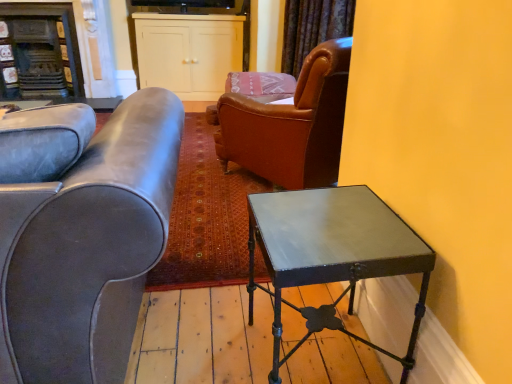
Question: From the image's perspective, is leather couch at left under velvet dark brown curtain at upper center?

Choices:
 (A) yes
 (B) no

Answer: (A)

Question: Is leather couch at left next to velvet dark brown curtain at upper center and touching it?

Choices:
 (A) yes
 (B) no

Answer: (B)

Question: Is leather couch at left at the right side of velvet dark brown curtain at upper center?

Choices:
 (A) yes
 (B) no

Answer: (B)

Question: Can you confirm if leather couch at left is wider than velvet dark brown curtain at upper center?

Choices:
 (A) no
 (B) yes

Answer: (B)

Question: Does leather couch at left have a larger size compared to velvet dark brown curtain at upper center?

Choices:
 (A) no
 (B) yes

Answer: (B)

Question: From a real-world perspective, is metallic dark green table at right positioned above or below white matte cabinet at upper center?

Choices:
 (A) below
 (B) above

Answer: (A)

Question: In the image, is metallic dark green table at right positioned in front of or behind white matte cabinet at upper center?

Choices:
 (A) front
 (B) behind

Answer: (A)

Question: Considering the positions of metallic dark green table at right and white matte cabinet at upper center in the image, is metallic dark green table at right wider or thinner than white matte cabinet at upper center?

Choices:
 (A) thin
 (B) wide

Answer: (A)

Question: Considering the positions of metallic dark green table at right and white matte cabinet at upper center in the image, is metallic dark green table at right bigger or smaller than white matte cabinet at upper center?

Choices:
 (A) big
 (B) small

Answer: (B)

Question: From the image's perspective, relative to velvet dark brown curtain at upper center, is white matte cabinet at upper center above or below?

Choices:
 (A) below
 (B) above

Answer: (B)

Question: Is white matte cabinet at upper center bigger or smaller than velvet dark brown curtain at upper center?

Choices:
 (A) big
 (B) small

Answer: (A)

Question: In the image, is white matte cabinet at upper center positioned in front of or behind velvet dark brown curtain at upper center?

Choices:
 (A) front
 (B) behind

Answer: (B)

Question: Looking at their shapes, would you say white matte cabinet at upper center is wider or thinner than velvet dark brown curtain at upper center?

Choices:
 (A) wide
 (B) thin

Answer: (A)

Question: From the image's perspective, is metallic dark green table at right located above or below dark brown wood fireplace at upper left?

Choices:
 (A) below
 (B) above

Answer: (A)

Question: Is metallic dark green table at right in front of or behind dark brown wood fireplace at upper left in the image?

Choices:
 (A) behind
 (B) front

Answer: (B)